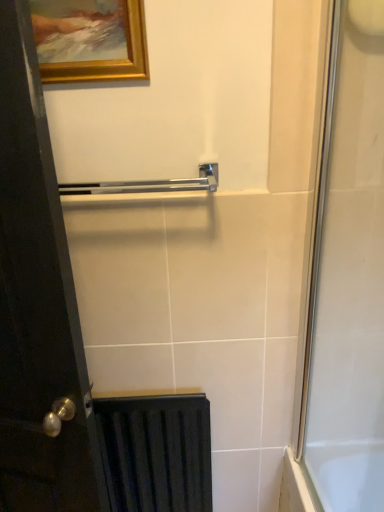
Question: In the image, is clear glass shower door at right positioned in front of or behind matte black radiator at lower left?

Choices:
 (A) behind
 (B) front

Answer: (B)

Question: Considering the positions of point (342, 39) and point (165, 481), is point (342, 39) closer or farther from the camera than point (165, 481)?

Choices:
 (A) closer
 (B) farther

Answer: (A)

Question: Based on their relative distances, which object is nearer to the black wood door at left?

Choices:
 (A) gold wooden picture frame at upper left
 (B) polished chrome towel bar at center
 (C) clear glass shower door at right
 (D) matte black radiator at lower left

Answer: (D)

Question: Which of these objects is positioned farthest from the matte black radiator at lower left?

Choices:
 (A) gold wooden picture frame at upper left
 (B) polished chrome towel bar at center
 (C) clear glass shower door at right
 (D) black wood door at left

Answer: (A)